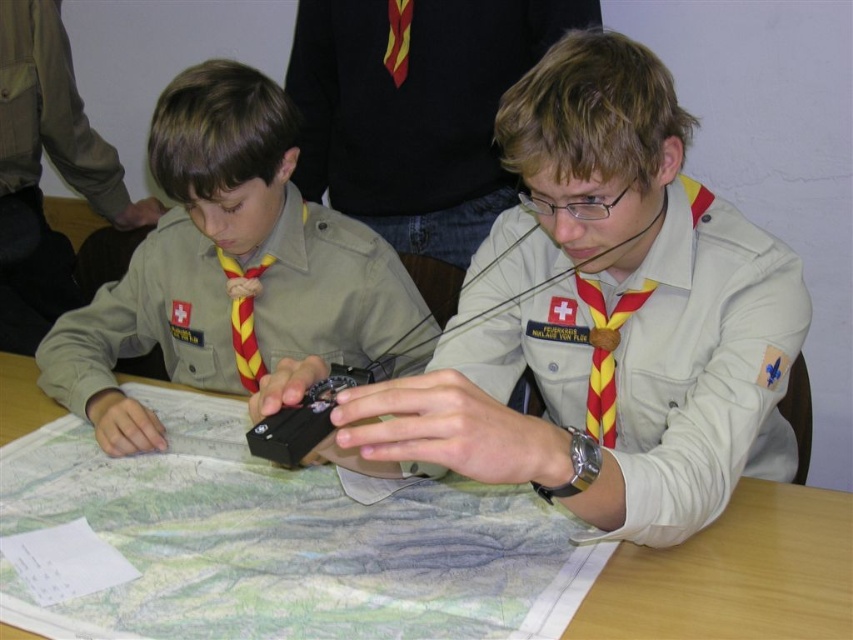
Question: Can you confirm if matte black compass at left is thinner than wooden table at center?

Choices:
 (A) no
 (B) yes

Answer: (A)

Question: Can you confirm if matte black compass at left is smaller than wooden table at center?

Choices:
 (A) yes
 (B) no

Answer: (B)

Question: Which object is closer to the camera taking this photo?

Choices:
 (A) wooden table at center
 (B) matte black compass at left

Answer: (A)

Question: Is matte black compass at left behind wooden table at center?

Choices:
 (A) yes
 (B) no

Answer: (A)

Question: Which point is farther to the camera?

Choices:
 (A) pyautogui.click(x=115, y=296)
 (B) pyautogui.click(x=54, y=404)

Answer: (A)